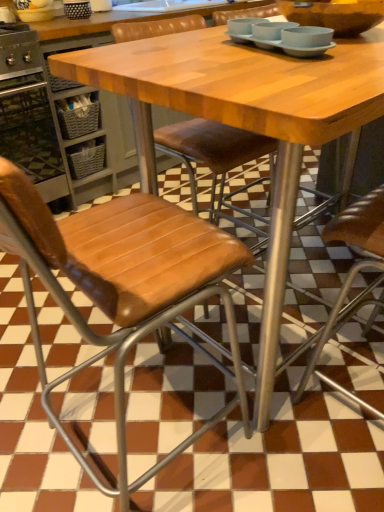
I want to click on free space below matte brown bowl at upper center (from a real-world perspective), so click(304, 305).